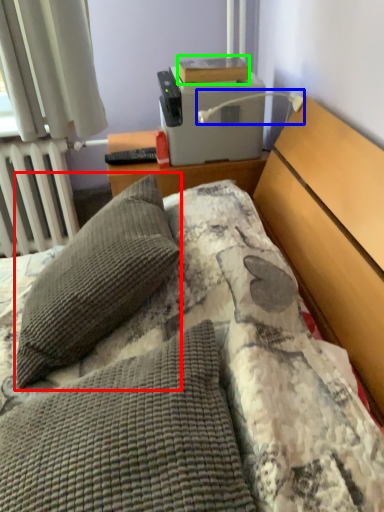
Question: Which object is positioned closest to pillow (highlighted by a red box)? Select from lamp (highlighted by a blue box) and book (highlighted by a green box).

Choices:
 (A) lamp
 (B) book

Answer: (A)